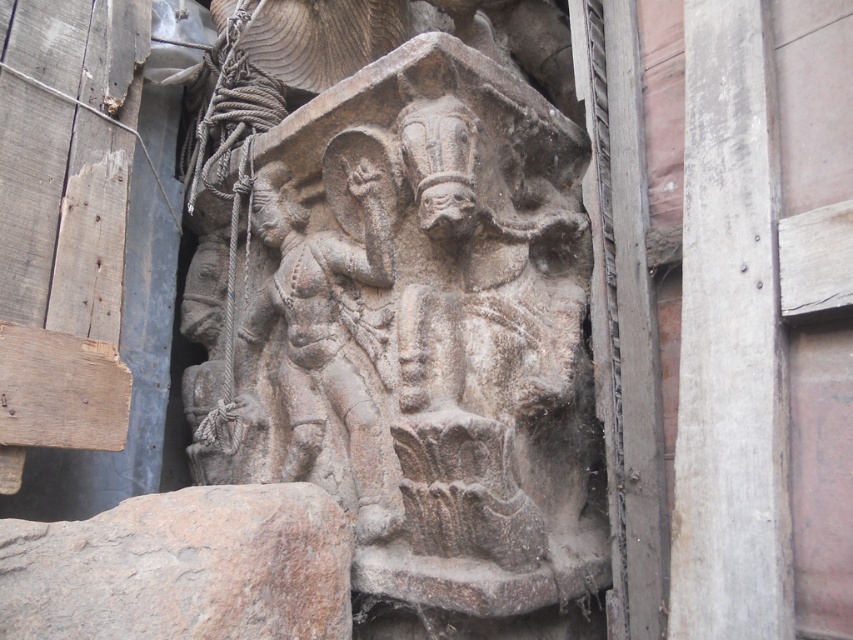
You are an art conservator examining the stone relief. You notice the smooth concrete pillar at right and the gray stone statue at center. Based on their positions, which object is closer to the right edge of the relief?

The smooth concrete pillar at right is to the right of the gray stone statue at center, so it is closer to the right edge of the relief.